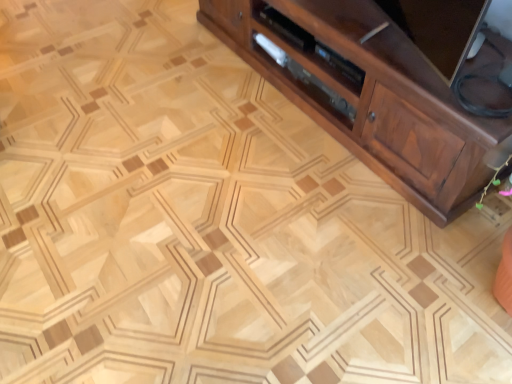
This screenshot has height=384, width=512. What do you see at coordinates (383, 85) in the screenshot? I see `brown wood cabinet at right` at bounding box center [383, 85].

What is the approximate width of brown wood cabinet at right?

The width of brown wood cabinet at right is 19.39 inches.

What is the approximate height of brown wood cabinet at right?

The height of brown wood cabinet at right is 17.68 inches.

Find the location of `brown wood cabinet at right`. brown wood cabinet at right is located at coordinates (383, 85).

What do you see at coordinates (304, 75) in the screenshot? I see `satin wood drawer at center` at bounding box center [304, 75].

Image resolution: width=512 pixels, height=384 pixels. I want to click on satin wood drawer at center, so click(x=304, y=75).

The image size is (512, 384). I want to click on brown wood cabinet at right, so click(383, 85).

Considering the positions of objects satin wood drawer at center and brown wood cabinet at right in the image provided, who is more to the left, satin wood drawer at center or brown wood cabinet at right?

satin wood drawer at center is more to the left.

Is satin wood drawer at center positioned behind brown wood cabinet at right?

Yes, it is behind brown wood cabinet at right.

Does point (275, 49) come closer to viewer compared to point (354, 79)?

No.

From the image's perspective, is satin wood drawer at center located beneath brown wood cabinet at right?

Yes, from the image's perspective, satin wood drawer at center is below brown wood cabinet at right.

From a real-world perspective, between satin wood drawer at center and brown wood cabinet at right, who is vertically higher?

From a 3D spatial view, brown wood cabinet at right is above.

Consider the image. Which of these two, satin wood drawer at center or brown wood cabinet at right, is thinner?

With smaller width is satin wood drawer at center.

From the picture: Is satin wood drawer at center taller or shorter than brown wood cabinet at right?

In the image, satin wood drawer at center appears to be shorter than brown wood cabinet at right.

Who is bigger, satin wood drawer at center or brown wood cabinet at right?

brown wood cabinet at right is bigger.

Is satin wood drawer at center spatially inside brown wood cabinet at right, or outside of it?

satin wood drawer at center can be found inside brown wood cabinet at right.

Is satin wood drawer at center next to brown wood cabinet at right?

No, satin wood drawer at center is not next to brown wood cabinet at right.

Is satin wood drawer at center facing away from brown wood cabinet at right?

Correct, satin wood drawer at center is looking away from brown wood cabinet at right.

How distant is satin wood drawer at center from brown wood cabinet at right?

satin wood drawer at center is 23.71 centimeters away from brown wood cabinet at right.

Locate an element on the screen. The image size is (512, 384). drawer located underneath the brown wood cabinet at right (from a real-world perspective) is located at coordinates (304, 75).

Considering the relative positions of brown wood cabinet at right and satin wood drawer at center in the image provided, is brown wood cabinet at right to the left of satin wood drawer at center from the viewer's perspective?

In fact, brown wood cabinet at right is to the right of satin wood drawer at center.

Is brown wood cabinet at right in front of satin wood drawer at center?

That is True.

Between point (362, 93) and point (338, 99), which one is positioned in front?

The point (362, 93) is in front.

From the image's perspective, is brown wood cabinet at right located above or below satin wood drawer at center?

brown wood cabinet at right is above satin wood drawer at center.

From a real-world perspective, is brown wood cabinet at right over satin wood drawer at center?

Indeed, from a real-world perspective, brown wood cabinet at right stands above satin wood drawer at center.

Based on the photo, which of these two, brown wood cabinet at right or satin wood drawer at center, is wider?

Wider between the two is brown wood cabinet at right.

Which of these two, brown wood cabinet at right or satin wood drawer at center, stands shorter?

satin wood drawer at center is shorter.

Is brown wood cabinet at right smaller than satin wood drawer at center?

No.

Is brown wood cabinet at right spatially inside satin wood drawer at center, or outside of it?

brown wood cabinet at right exists outside the volume of satin wood drawer at center.

Is brown wood cabinet at right positioned far away from satin wood drawer at center?

No, brown wood cabinet at right is in close proximity to satin wood drawer at center.

Is brown wood cabinet at right looking in the opposite direction of satin wood drawer at center?

Correct, brown wood cabinet at right is looking away from satin wood drawer at center.

In order to click on cabinetry that appears on the right of satin wood drawer at center in this screenshot , I will do `click(383, 85)`.

Identify the location of drawer below the brown wood cabinet at right (from the image's perspective). (304, 75).

What are the coordinates of `drawer behind the brown wood cabinet at right` in the screenshot? It's located at (304, 75).